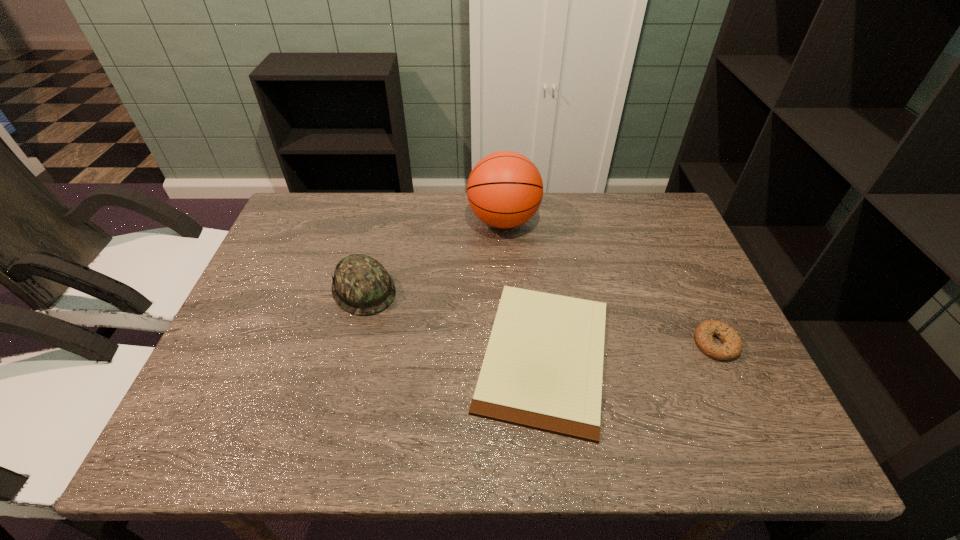
Find the location of a particular element. The image size is (960, 540). the farthest object is located at coordinates (505, 189).

Locate an element on the screen. This screenshot has height=540, width=960. basketball is located at coordinates (505, 189).

Find the location of a particular element. headwear is located at coordinates (361, 286).

Where is `the leftmost object`? the leftmost object is located at coordinates (361, 286).

Where is `bagel`? The width and height of the screenshot is (960, 540). bagel is located at coordinates (732, 346).

Where is `the rightmost object`? the rightmost object is located at coordinates (732, 346).

Identify the location of clipboard. click(x=543, y=367).

This screenshot has height=540, width=960. Find the location of `vacant space located 0.220m on the front of the tallest object`. vacant space located 0.220m on the front of the tallest object is located at coordinates (509, 301).

This screenshot has height=540, width=960. I want to click on free space located 0.200m on the back of the headwear, so click(x=381, y=221).

The height and width of the screenshot is (540, 960). In order to click on vacant space located 0.160m on the left of the third tallest object in this screenshot , I will do `click(626, 343)`.